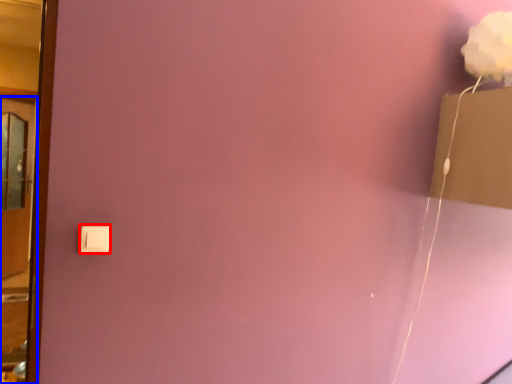
Question: Which object appears farthest to the camera in this image, light switch (highlighted by a red box) or door (highlighted by a blue box)?

Choices:
 (A) light switch
 (B) door

Answer: (A)